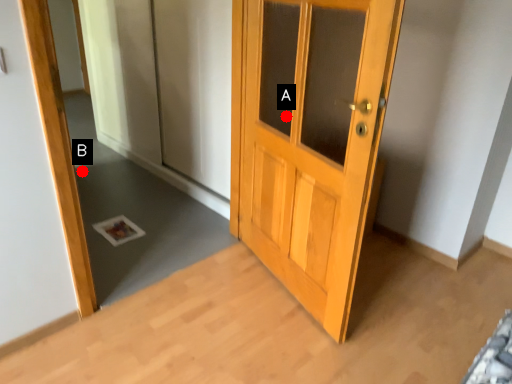
Question: Two points are circled on the image, labeled by A and B beside each circle. Among these points, which one is farthest from the camera?

Choices:
 (A) A is further
 (B) B is further

Answer: (B)